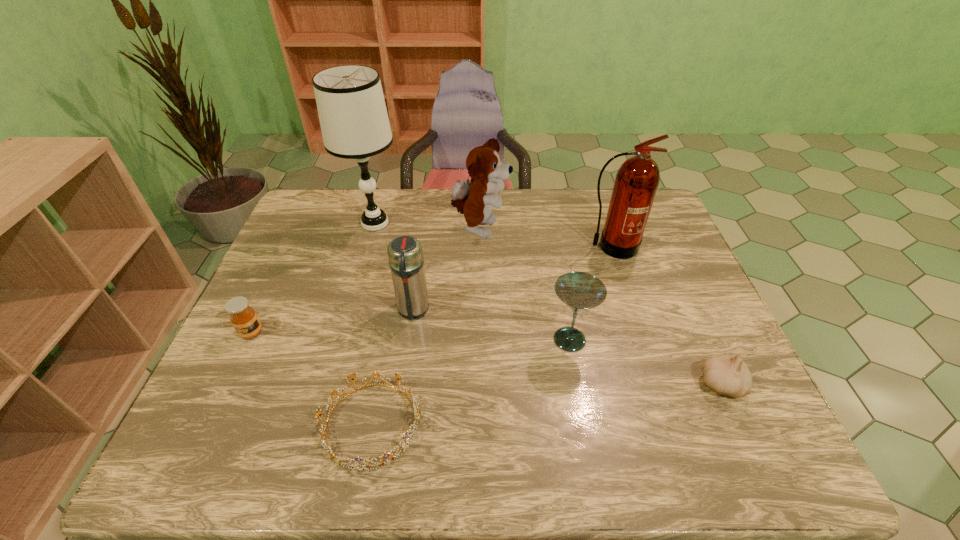
What are the coordinates of `the shortest object` in the screenshot? It's located at (334, 392).

What are the coordinates of `vacant space located 0.160m on the front of the table lamp` in the screenshot? It's located at (360, 278).

The height and width of the screenshot is (540, 960). In order to click on vacant region located on the front-facing side of the seventh shortest object in this screenshot , I will do `click(641, 337)`.

This screenshot has height=540, width=960. What are the coordinates of `vacant region located on the face of the puppy` in the screenshot? It's located at pyautogui.click(x=607, y=230).

This screenshot has width=960, height=540. I want to click on free location located 0.190m with a handle on the side of the thermos bottle, so click(401, 391).

Where is `free region located on the left of the fourth shortest object`? Image resolution: width=960 pixels, height=540 pixels. free region located on the left of the fourth shortest object is located at coordinates (405, 340).

Where is `free region located 0.150m on the front-facing side of the honey`? free region located 0.150m on the front-facing side of the honey is located at coordinates (222, 395).

Where is `vacant area situated 0.080m on the back of the garlic`? The image size is (960, 540). vacant area situated 0.080m on the back of the garlic is located at coordinates (701, 339).

The image size is (960, 540). Identify the location of vacant space located 0.350m on the front-facing side of the shortest object. (588, 424).

Where is `table lamp that is at the far edge`? table lamp that is at the far edge is located at coordinates (354, 122).